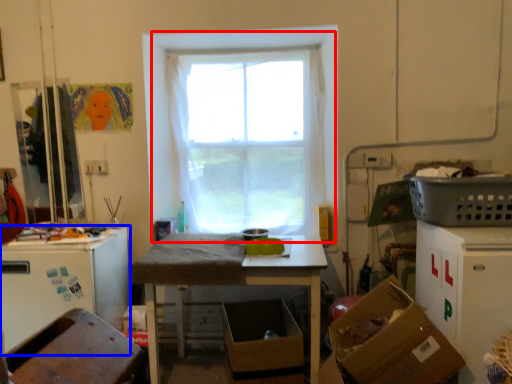
Question: Which point is closer to the camera, window (highlighted by a red box) or leftover (highlighted by a blue box)?

Choices:
 (A) window
 (B) leftover

Answer: (B)